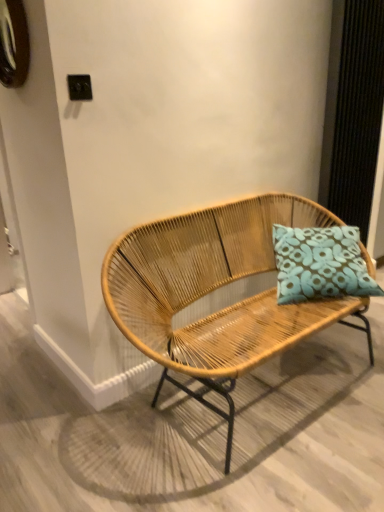
This screenshot has height=512, width=384. What do you see at coordinates (320, 264) in the screenshot?
I see `teal fabric pillow at center` at bounding box center [320, 264].

Image resolution: width=384 pixels, height=512 pixels. Describe the element at coordinates (215, 291) in the screenshot. I see `natural wood bench at center` at that location.

Image resolution: width=384 pixels, height=512 pixels. Identify the location of teal fabric pillow at center. (320, 264).

Considering the positions of points (19, 19) and (218, 285), is point (19, 19) closer to camera compared to point (218, 285)?

Yes, it is in front of point (218, 285).

From the image's perspective, which object appears higher, brushed metal clock at upper left or natural wood bench at center?

brushed metal clock at upper left, from the image's perspective.

Which of these two, brushed metal clock at upper left or natural wood bench at center, is smaller?

Smaller between the two is brushed metal clock at upper left.

Is brushed metal clock at upper left not close to teal fabric pillow at center?

brushed metal clock at upper left is positioned a significant distance from teal fabric pillow at center.

Is brushed metal clock at upper left oriented towards teal fabric pillow at center?

No.

How different are the orientations of brushed metal clock at upper left and teal fabric pillow at center in degrees?

They differ by 50.4 degrees in their facing directions.

Is brushed metal clock at upper left at the back of teal fabric pillow at center?

No, brushed metal clock at upper left is not at the back of teal fabric pillow at center.

Image resolution: width=384 pixels, height=512 pixels. Identify the location of oval that appears on the left of teal fabric pillow at center. (13, 44).

Are teal fabric pillow at center and brushed metal clock at upper left far apart?

Indeed, teal fabric pillow at center is not near brushed metal clock at upper left.

From a real-world perspective, which object rests below the other?

teal fabric pillow at center, from a real-world perspective.

Which object is positioned more to the right, natural wood bench at center or brushed metal clock at upper left?

natural wood bench at center is more to the right.

Is natural wood bench at center aimed at brushed metal clock at upper left?

No, natural wood bench at center is not facing towards brushed metal clock at upper left.

Is natural wood bench at center bigger than brushed metal clock at upper left?

Yes.

Considering the positions of point (237, 264) and point (9, 42), is point (237, 264) closer or farther from the camera than point (9, 42)?

Clearly, point (237, 264) is more distant from the camera than point (9, 42).

Can we say natural wood bench at center lies outside teal fabric pillow at center?

Yes, natural wood bench at center is not within teal fabric pillow at center.

In terms of width, does natural wood bench at center look wider or thinner when compared to teal fabric pillow at center?

Considering their sizes, natural wood bench at center looks broader than teal fabric pillow at center.

Which is more to the left, natural wood bench at center or teal fabric pillow at center?

From the viewer's perspective, natural wood bench at center appears more on the left side.

Is natural wood bench at center positioned behind teal fabric pillow at center?

That is False.

Can you confirm if teal fabric pillow at center is positioned to the right of natural wood bench at center?

Indeed, teal fabric pillow at center is positioned on the right side of natural wood bench at center.

Is teal fabric pillow at center positioned beyond the bounds of natural wood bench at center?

No, teal fabric pillow at center is not outside of natural wood bench at center.

Considering the relative positions of teal fabric pillow at center and natural wood bench at center in the image provided, is teal fabric pillow at center in front of natural wood bench at center?

No, teal fabric pillow at center is behind natural wood bench at center.

Does teal fabric pillow at center have a lesser width compared to natural wood bench at center?

Correct, the width of teal fabric pillow at center is less than that of natural wood bench at center.

What are the coordinates of `oval lying on the left of natural wood bench at center` in the screenshot? It's located at (13, 44).

I want to click on pillow behind the brushed metal clock at upper left, so click(320, 264).

From the picture: Estimate the real-world distances between objects in this image. Which object is closer to teal fabric pillow at center, natural wood bench at center or brushed metal clock at upper left?

natural wood bench at center is closer to teal fabric pillow at center.

Which object lies further to the anchor point teal fabric pillow at center, brushed metal clock at upper left or natural wood bench at center?

The object further to teal fabric pillow at center is brushed metal clock at upper left.

From the image, which object appears to be farther from natural wood bench at center, teal fabric pillow at center or brushed metal clock at upper left?

brushed metal clock at upper left.

Which object lies nearer to the anchor point natural wood bench at center, brushed metal clock at upper left or teal fabric pillow at center?

teal fabric pillow at center.

Looking at the image, which one is located further to brushed metal clock at upper left, teal fabric pillow at center or natural wood bench at center?

The object further to brushed metal clock at upper left is teal fabric pillow at center.

Consider the image. Looking at the image, which one is located further to brushed metal clock at upper left, natural wood bench at center or teal fabric pillow at center?

teal fabric pillow at center lies further to brushed metal clock at upper left than the other object.

You are a GUI agent. You are given a task and a screenshot of the screen. Output one action in this format:
    pyautogui.click(x=<x>, y=<y>)
    Task: Click on the bench between brushed metal clock at upper left and teal fabric pillow at center
    Image resolution: width=384 pixels, height=512 pixels.
    Given the screenshot: What is the action you would take?
    pyautogui.click(x=215, y=291)